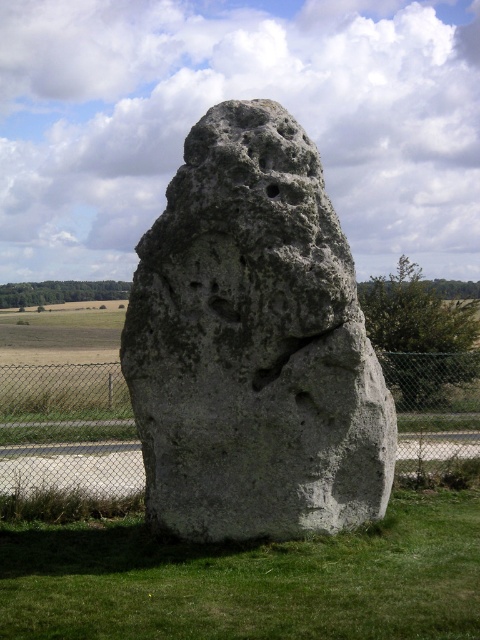
Question: Can you confirm if green grass at lower center is positioned below metal chain-link fence at center?

Choices:
 (A) no
 (B) yes

Answer: (B)

Question: Which object is positioned farthest from the green grass at lower center?

Choices:
 (A) metal chain-link fence at center
 (B) gray rough stone at center

Answer: (A)

Question: Can you confirm if gray rough stone at center is positioned above green grass at lower center?

Choices:
 (A) no
 (B) yes

Answer: (B)

Question: Which of these objects is positioned closest to the metal chain-link fence at center?

Choices:
 (A) gray rough stone at center
 (B) green grass at lower center

Answer: (A)

Question: Which of the following is the farthest from the observer?

Choices:
 (A) click(321, 250)
 (B) click(99, 580)
 (C) click(34, 426)

Answer: (C)

Question: Observing the image, what is the correct spatial positioning of green grass at lower center in reference to metal chain-link fence at center?

Choices:
 (A) right
 (B) left

Answer: (A)